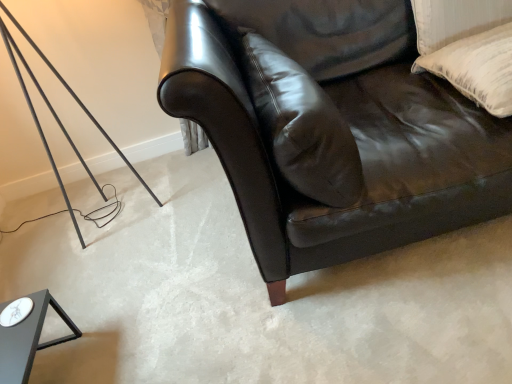
Image resolution: width=512 pixels, height=384 pixels. Identify the location of white textured pillow at upper right, the second pillow viewed from the left. (477, 68).

Image resolution: width=512 pixels, height=384 pixels. What do you see at coordinates (302, 126) in the screenshot? I see `leather pillow at center, the first pillow when ordered from left to right` at bounding box center [302, 126].

Measure the distance between shiny black leather couch at center and camera.

shiny black leather couch at center and camera are 36.50 inches apart.

What are the coordinates of `white textured pillow at upper right, the second pillow viewed from the left` in the screenshot? It's located at (477, 68).

Which point is more forward, [166,50] or [435,59]?

The point [166,50] is in front.

Is shiny black leather couch at center bigger or smaller than white textured pillow at upper right, the second pillow viewed from the left?

In the image, shiny black leather couch at center appears to be larger than white textured pillow at upper right, the second pillow viewed from the left.

Are shiny black leather couch at center and white textured pillow at upper right, the second pillow viewed from the left, located far from each other?

shiny black leather couch at center is actually quite close to white textured pillow at upper right, the second pillow viewed from the left.

Based on the photo, is leather pillow at center, which is the second pillow from right to left, not within white textured pillow at upper right, the second pillow viewed from the left?

Yes.

Is leather pillow at center, the first pillow when ordered from left to right, oriented towards white textured pillow at upper right, the first pillow positioned from the right?

Yes, leather pillow at center, the first pillow when ordered from left to right, is facing white textured pillow at upper right, the first pillow positioned from the right.

At what (x,y) coordinates should I click in order to perform the action: click on pillow above the leather pillow at center, which is the second pillow from right to left (from the image's perspective). Please return your answer as a coordinate pair (x, y). Image resolution: width=512 pixels, height=384 pixels. Looking at the image, I should click on (477, 68).

Between leather pillow at center, the first pillow when ordered from left to right, and white textured pillow at upper right, the first pillow positioned from the right, which one appears on the right side from the viewer's perspective?

Positioned to the right is white textured pillow at upper right, the first pillow positioned from the right.

Considering the positions of objects shiny black leather couch at center and leather pillow at center, the first pillow when ordered from left to right, in the image provided, who is more to the right, shiny black leather couch at center or leather pillow at center, the first pillow when ordered from left to right,?

From the viewer's perspective, shiny black leather couch at center appears more on the right side.

Which object is further away from the camera, shiny black leather couch at center or leather pillow at center, which is the second pillow from right to left?

leather pillow at center, which is the second pillow from right to left, is further away from the camera.

Is leather pillow at center, the first pillow when ordered from left to right, at the back of shiny black leather couch at center?

No, shiny black leather couch at center is not facing away from leather pillow at center, the first pillow when ordered from left to right.

Which object is more forward, white textured pillow at upper right, the first pillow positioned from the right, or shiny black leather couch at center?

shiny black leather couch at center is more forward.

Based on their positions, is white textured pillow at upper right, the second pillow viewed from the left, located to the left or right of shiny black leather couch at center?

From the image, it's evident that white textured pillow at upper right, the second pillow viewed from the left, is to the right of shiny black leather couch at center.

In terms of width, does white textured pillow at upper right, the first pillow positioned from the right, look wider or thinner when compared to shiny black leather couch at center?

Clearly, white textured pillow at upper right, the first pillow positioned from the right, has less width compared to shiny black leather couch at center.

Is leather pillow at center, which is the second pillow from right to left, oriented towards shiny black leather couch at center?

Yes, leather pillow at center, which is the second pillow from right to left, is turned towards shiny black leather couch at center.

Would you say leather pillow at center, the first pillow when ordered from left to right, is outside shiny black leather couch at center?

No, most part of leather pillow at center, the first pillow when ordered from left to right, lies within shiny black leather couch at center.

Can you confirm if leather pillow at center, which is the second pillow from right to left, is positioned to the left of shiny black leather couch at center?

Yes.

From the image's perspective, which is above, leather pillow at center, the first pillow when ordered from left to right, or shiny black leather couch at center?

From the image's view, shiny black leather couch at center is above.

In the scene shown: Which is nearer, [440,70] or [324,108]?

Clearly, point [440,70] is more distant from the camera than point [324,108].

From a real-world perspective, between white textured pillow at upper right, the second pillow viewed from the left, and leather pillow at center, which is the second pillow from right to left, who is vertically higher?

leather pillow at center, which is the second pillow from right to left, is physically above.

Is leather pillow at center, which is the second pillow from right to left, located within white textured pillow at upper right, the second pillow viewed from the left?

Definitely not — leather pillow at center, which is the second pillow from right to left, is not inside white textured pillow at upper right, the second pillow viewed from the left.

Looking at this image, can you confirm if white textured pillow at upper right, the second pillow viewed from the left, is wider than leather pillow at center, which is the second pillow from right to left?

Correct, the width of white textured pillow at upper right, the second pillow viewed from the left, exceeds that of leather pillow at center, which is the second pillow from right to left.

Find the location of `the 2nd pillow behind the shiny black leather couch at center, counting from the anchor's position`. the 2nd pillow behind the shiny black leather couch at center, counting from the anchor's position is located at coordinates (477, 68).

Where is `pillow located on the right of leather pillow at center, the first pillow when ordered from left to right`? This screenshot has height=384, width=512. pillow located on the right of leather pillow at center, the first pillow when ordered from left to right is located at coordinates (477, 68).

Which object lies nearer to the anchor point leather pillow at center, the first pillow when ordered from left to right, white textured pillow at upper right, the first pillow positioned from the right, or shiny black leather couch at center?

shiny black leather couch at center is closer to leather pillow at center, the first pillow when ordered from left to right.

Looking at the image, which one is located further to shiny black leather couch at center, leather pillow at center, which is the second pillow from right to left, or white textured pillow at upper right, the second pillow viewed from the left?

white textured pillow at upper right, the second pillow viewed from the left, lies further to shiny black leather couch at center than the other object.

From the image, which object appears to be nearer to shiny black leather couch at center, white textured pillow at upper right, the second pillow viewed from the left, or leather pillow at center, the first pillow when ordered from left to right?

leather pillow at center, the first pillow when ordered from left to right.

Based on their spatial positions, is leather pillow at center, the first pillow when ordered from left to right, or shiny black leather couch at center further from white textured pillow at upper right, the second pillow viewed from the left?

Among the two, leather pillow at center, the first pillow when ordered from left to right, is located further to white textured pillow at upper right, the second pillow viewed from the left.

Estimate the real-world distances between objects in this image. Which object is further from leather pillow at center, the first pillow when ordered from left to right, shiny black leather couch at center or white textured pillow at upper right, the second pillow viewed from the left?

Based on the image, white textured pillow at upper right, the second pillow viewed from the left, appears to be further to leather pillow at center, the first pillow when ordered from left to right.

Estimate the real-world distances between objects in this image. Which object is further from white textured pillow at upper right, the second pillow viewed from the left, shiny black leather couch at center or leather pillow at center, which is the second pillow from right to left?

leather pillow at center, which is the second pillow from right to left, is positioned further to the anchor white textured pillow at upper right, the second pillow viewed from the left.

Identify the location of studio couch located between leather pillow at center, which is the second pillow from right to left, and white textured pillow at upper right, the second pillow viewed from the left, in the left-right direction. (358, 147).